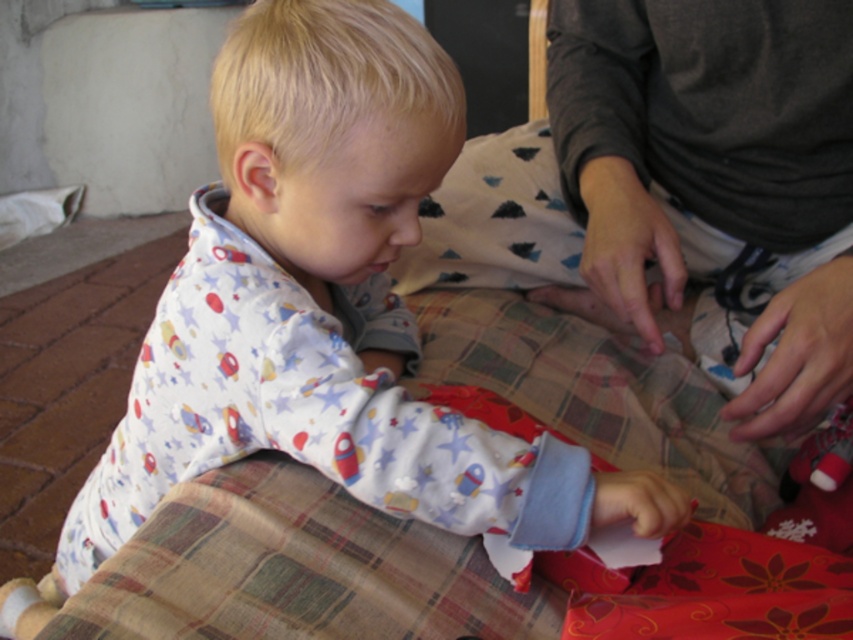
Question: Does white cotton pajamas at center have a larger size compared to dark gray fabric at center?

Choices:
 (A) no
 (B) yes

Answer: (B)

Question: Can you confirm if white cotton pajamas at center is positioned to the right of dark gray fabric at center?

Choices:
 (A) yes
 (B) no

Answer: (B)

Question: Does white cotton pajamas at center appear over dark gray fabric at center?

Choices:
 (A) no
 (B) yes

Answer: (A)